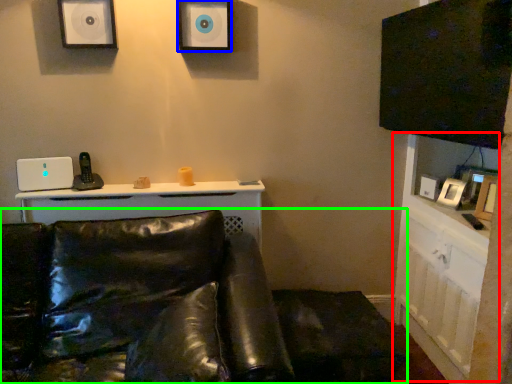
Question: Which is nearer to the dresser (highlighted by a red box)? speaker (highlighted by a blue box) or studio couch (highlighted by a green box).

Choices:
 (A) speaker
 (B) studio couch

Answer: (B)